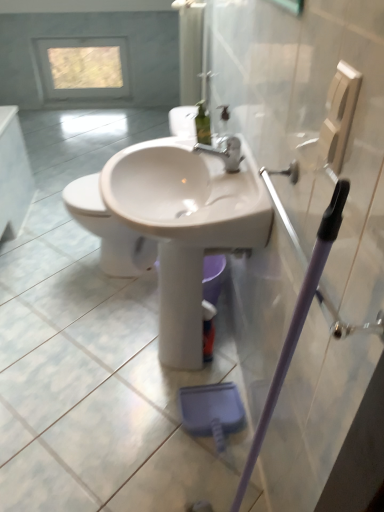
What are the coordinates of `vacant region in front of white glossy toilet at center` in the screenshot? It's located at (93, 329).